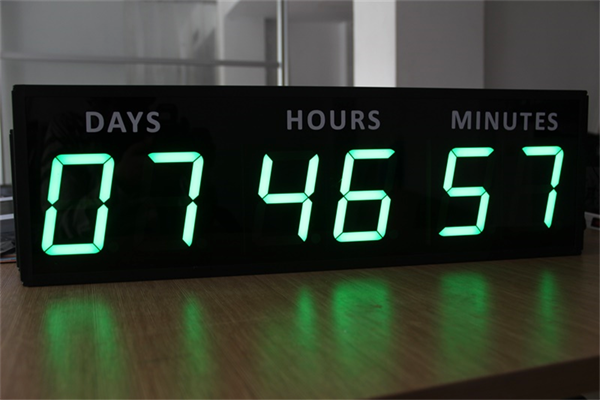
The image size is (600, 400). What are the coordinates of `empty space to the right of the clock` in the screenshot? It's located at (590, 164).